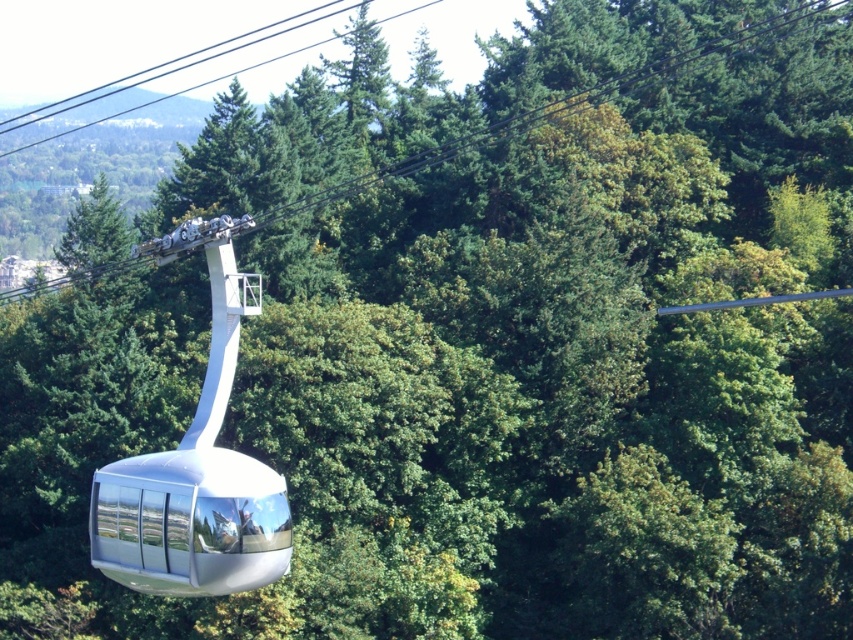
Who is positioned more to the right, black cable at upper center or polished silver gondola at center?

black cable at upper center is more to the right.

Where is `black cable at upper center`? black cable at upper center is located at coordinates (614, 90).

Find the location of a particular element. The width and height of the screenshot is (853, 640). black cable at upper center is located at coordinates (614, 90).

Who is shorter, black cable at upper center or black wire at upper center?

Standing shorter between the two is black wire at upper center.

Does point (431, 134) lie behind point (332, 36)?

No, (431, 134) is closer to viewer.

Image resolution: width=853 pixels, height=640 pixels. Identify the location of black cable at upper center. (614, 90).

Can you confirm if polished silver gondola at center is positioned below black wire at upper center?

Indeed, polished silver gondola at center is positioned under black wire at upper center.

Locate an element on the screen. polished silver gondola at center is located at coordinates (196, 483).

Which is behind, point (148, 493) or point (256, 64)?

The point (256, 64) is behind.

Where is `polished silver gondola at center`? polished silver gondola at center is located at coordinates (196, 483).